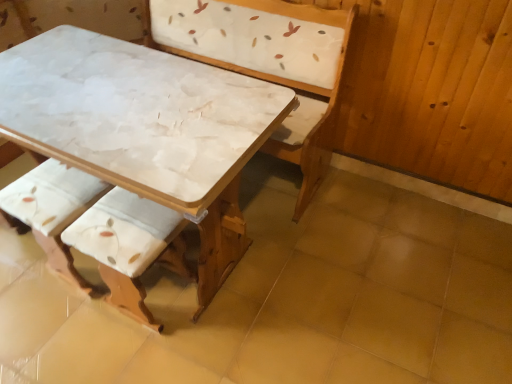
Question: Can you confirm if white fabric cushion at lower left, which is the 2th armchair from right to left, is bigger than white fabric cushion at lower left, the 1th armchair from the right?

Choices:
 (A) no
 (B) yes

Answer: (A)

Question: Does white fabric cushion at lower left, arranged as the 1th armchair when viewed from the left, have a lesser height compared to white fabric cushion at lower left, the 2th armchair positioned from the left?

Choices:
 (A) no
 (B) yes

Answer: (B)

Question: From a real-world perspective, does white fabric cushion at lower left, arranged as the 1th armchair when viewed from the left, stand above white fabric cushion at lower left, the 1th armchair from the right?

Choices:
 (A) yes
 (B) no

Answer: (B)

Question: Is white fabric cushion at lower left, arranged as the 1th armchair when viewed from the left, located outside white fabric cushion at lower left, the 1th armchair from the right?

Choices:
 (A) no
 (B) yes

Answer: (B)

Question: Does white fabric cushion at lower left, arranged as the 1th armchair when viewed from the left, have a greater width compared to white fabric cushion at lower left, the 2th armchair positioned from the left?

Choices:
 (A) yes
 (B) no

Answer: (B)

Question: Is white fabric cushion at lower left, which is the 2th armchair from right to left, behind white fabric cushion at lower left, the 1th armchair from the right?

Choices:
 (A) no
 (B) yes

Answer: (B)

Question: Is white marble table at center in front of white fabric cushion at lower left, arranged as the 1th armchair when viewed from the left?

Choices:
 (A) yes
 (B) no

Answer: (A)

Question: Would you say white marble table at center is a long distance from white fabric cushion at lower left, arranged as the 1th armchair when viewed from the left?

Choices:
 (A) yes
 (B) no

Answer: (B)

Question: Is white marble table at center touching white fabric cushion at lower left, arranged as the 1th armchair when viewed from the left?

Choices:
 (A) no
 (B) yes

Answer: (A)

Question: Is white marble table at center shorter than white fabric cushion at lower left, which is the 2th armchair from right to left?

Choices:
 (A) no
 (B) yes

Answer: (B)

Question: Does white marble table at center appear on the right side of white fabric cushion at lower left, arranged as the 1th armchair when viewed from the left?

Choices:
 (A) yes
 (B) no

Answer: (A)

Question: From a real-world perspective, is white marble table at center positioned over white fabric cushion at lower left, arranged as the 1th armchair when viewed from the left, based on gravity?

Choices:
 (A) no
 (B) yes

Answer: (A)

Question: Does white marble table at center have a smaller size compared to white marble table at center?

Choices:
 (A) yes
 (B) no

Answer: (A)